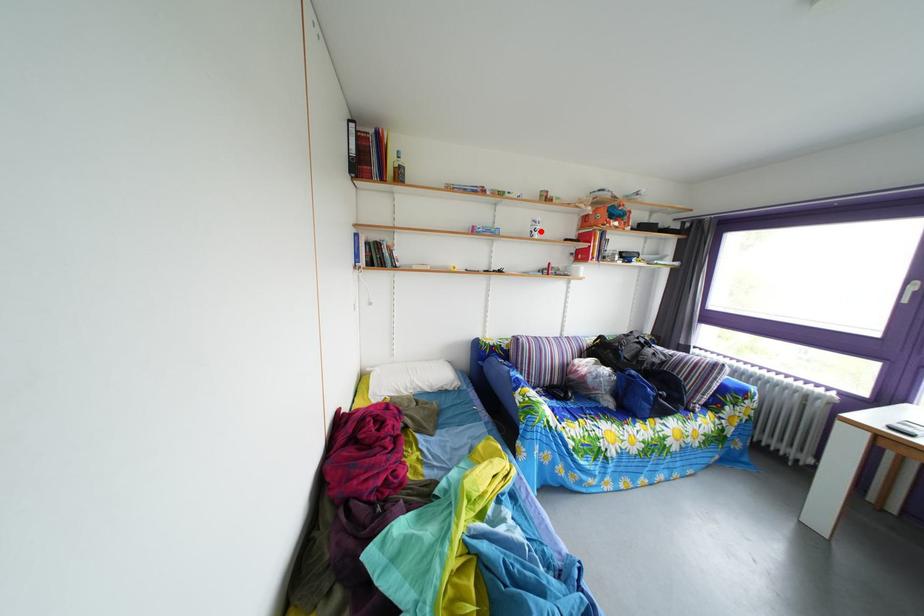
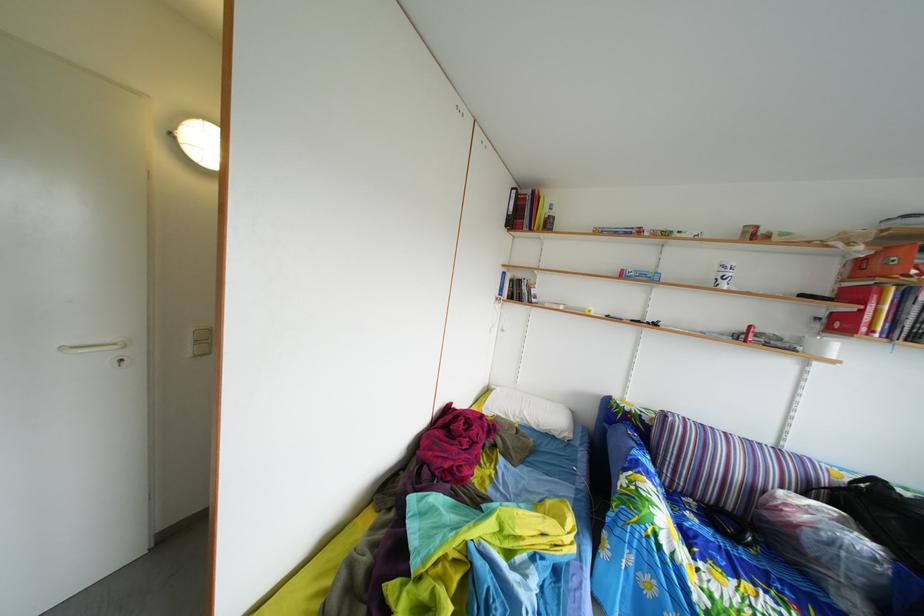
Find the pixel in the second image that matches the highlighted location in the first image.

(727, 276)